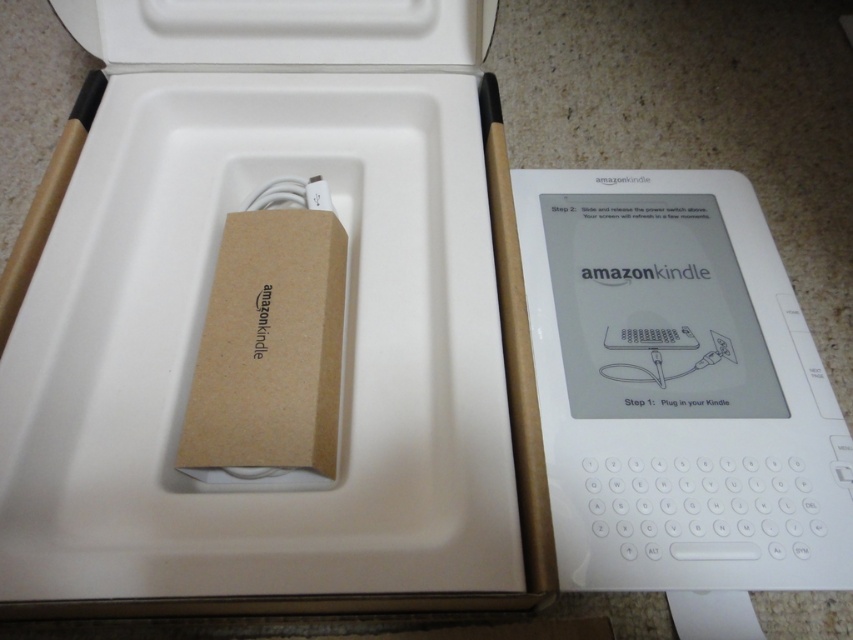
You are standing in front of the image and see two points labeled as point (x=338, y=93) and point (x=772, y=564). Which point appears closer to you?

Point (x=338, y=93) is closer to you because it is further to the viewer than point (x=772, y=564).